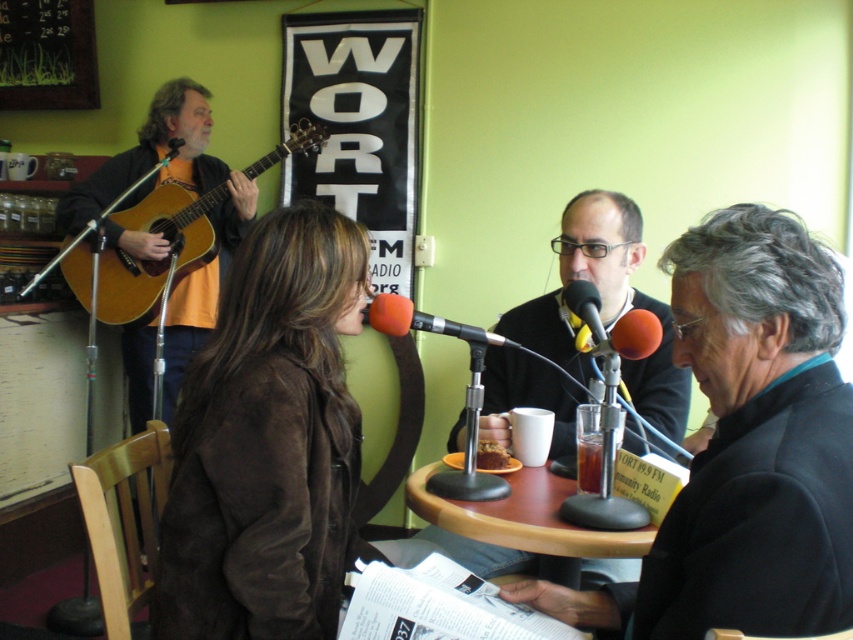
Does orange foam microphone at center have a lesser width compared to rubberized red microphone at center?

Incorrect, orange foam microphone at center's width is not less than rubberized red microphone at center's.

Between orange foam microphone at center and rubberized red microphone at center, which one appears on the left side from the viewer's perspective?

Positioned to the left is orange foam microphone at center.

Where is `orange foam microphone at center`? orange foam microphone at center is located at coordinates (422, 321).

Where is `orange foam microphone at center`? Image resolution: width=853 pixels, height=640 pixels. orange foam microphone at center is located at coordinates (422, 321).

This screenshot has height=640, width=853. Find the location of `brown suede jacket at center`. brown suede jacket at center is located at coordinates (268, 442).

Is brown suede jacket at center wider than wooden acoustic guitar at left?

In fact, brown suede jacket at center might be narrower than wooden acoustic guitar at left.

Is point (190, 394) more distant than point (164, 225)?

No, it is in front of (164, 225).

At what (x,y) coordinates should I click in order to perform the action: click on brown suede jacket at center. Please return your answer as a coordinate pair (x, y). This screenshot has height=640, width=853. Looking at the image, I should click on (268, 442).

Can you confirm if wooden table at center is bigger than rubberized red microphone at center?

Yes.

Does wooden table at center appear over rubberized red microphone at center?

Incorrect, wooden table at center is not positioned above rubberized red microphone at center.

The image size is (853, 640). I want to click on wooden table at center, so click(524, 531).